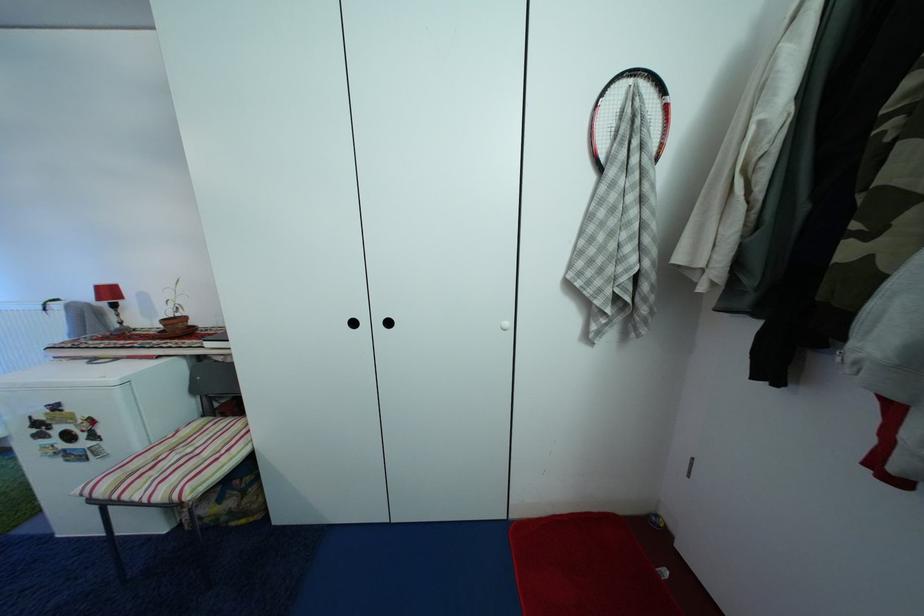
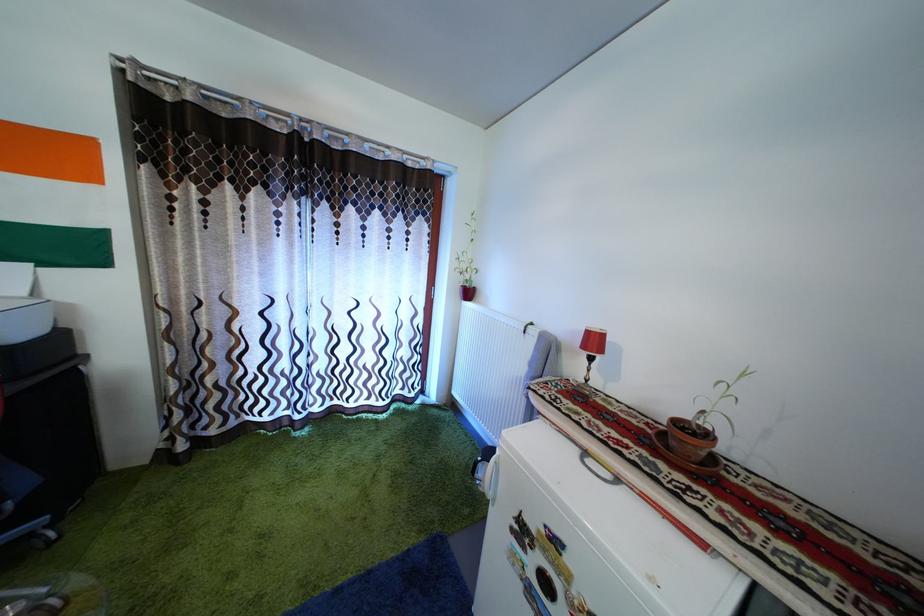
Find the pixel in the second image that matches (106,294) in the first image.

(598, 339)